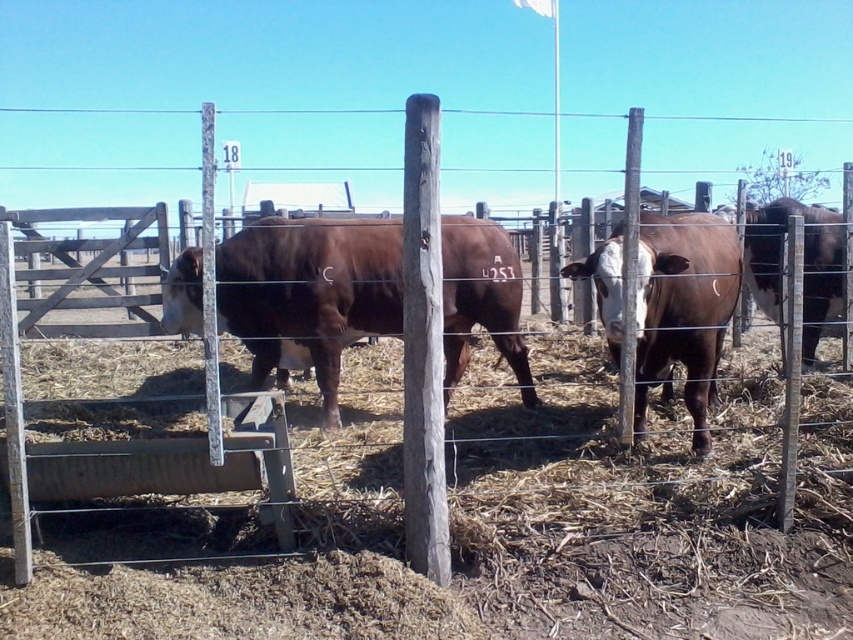
Question: Which object appears closest to the camera in this image?

Choices:
 (A) brown smooth cow at center
 (B) white-brown textured cow at center

Answer: (B)

Question: Does brown smooth cow at center have a larger size compared to gray weathered wood post at center?

Choices:
 (A) yes
 (B) no

Answer: (A)

Question: Is white-brown textured cow at center closer to camera compared to gray weathered wood post at center?

Choices:
 (A) no
 (B) yes

Answer: (A)

Question: Does brown smooth cow at center have a greater width compared to white-brown textured cow at center?

Choices:
 (A) no
 (B) yes

Answer: (B)

Question: Which point appears farthest from the camera in this image?

Choices:
 (A) (828, 220)
 (B) (576, 260)

Answer: (A)

Question: Which point appears closest to the camera in this image?

Choices:
 (A) (428, 275)
 (B) (360, 332)

Answer: (A)